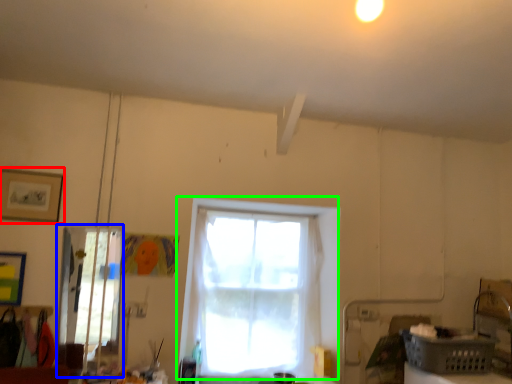
Question: Considering the real-world distances, which object is closest to picture frame (highlighted by a red box)? glass door (highlighted by a blue box) or window (highlighted by a green box).

Choices:
 (A) glass door
 (B) window

Answer: (A)